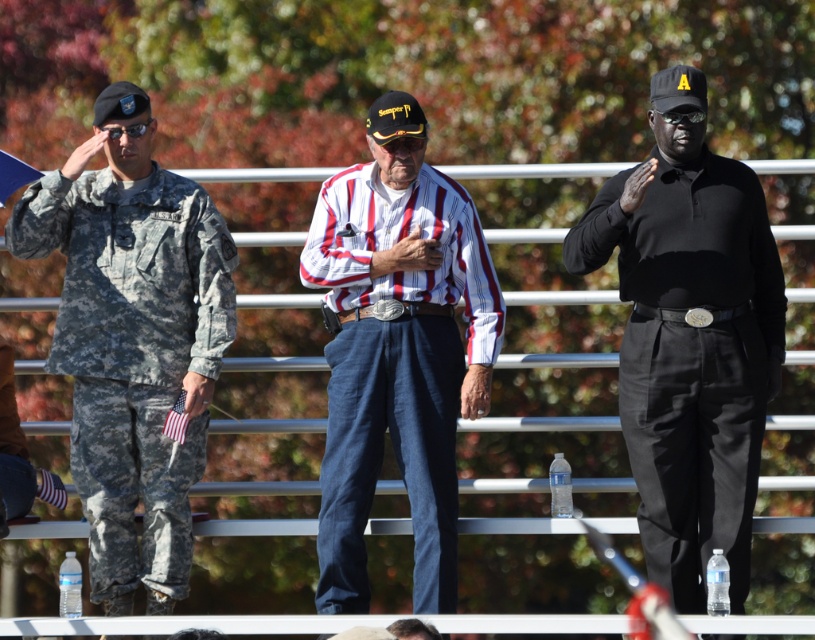
Question: Which object appears farthest from the camera in this image?

Choices:
 (A) camouflage fabric uniform at left
 (B) black leather cap at center
 (C) striped cotton shirt at center

Answer: (A)

Question: Which point is closer to the camera taking this photo?

Choices:
 (A) (668, 97)
 (B) (124, 483)

Answer: (A)

Question: Is black leather cap at center thinner than striped cotton shirt at center?

Choices:
 (A) yes
 (B) no

Answer: (B)

Question: Which of these objects is positioned closest to the striped cotton shirt at center?

Choices:
 (A) camouflage fabric uniform at left
 (B) black leather cap at center

Answer: (A)

Question: Is striped cotton shirt at center wider than camouflage fabric uniform at left?

Choices:
 (A) yes
 (B) no

Answer: (B)

Question: Can you confirm if black leather cap at center is positioned below camouflage fabric uniform at left?

Choices:
 (A) yes
 (B) no

Answer: (B)